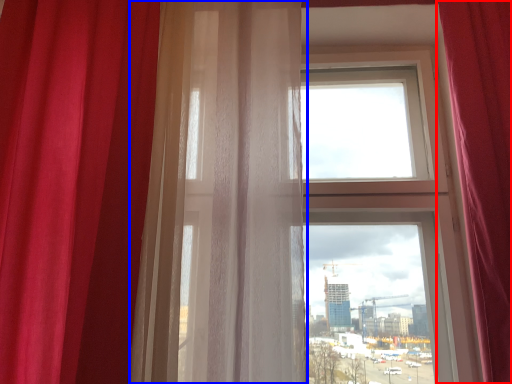
Question: Which of the following is the farthest to the observer, curtain (highlighted by a red box) or curtain (highlighted by a blue box)?

Choices:
 (A) curtain
 (B) curtain

Answer: (B)